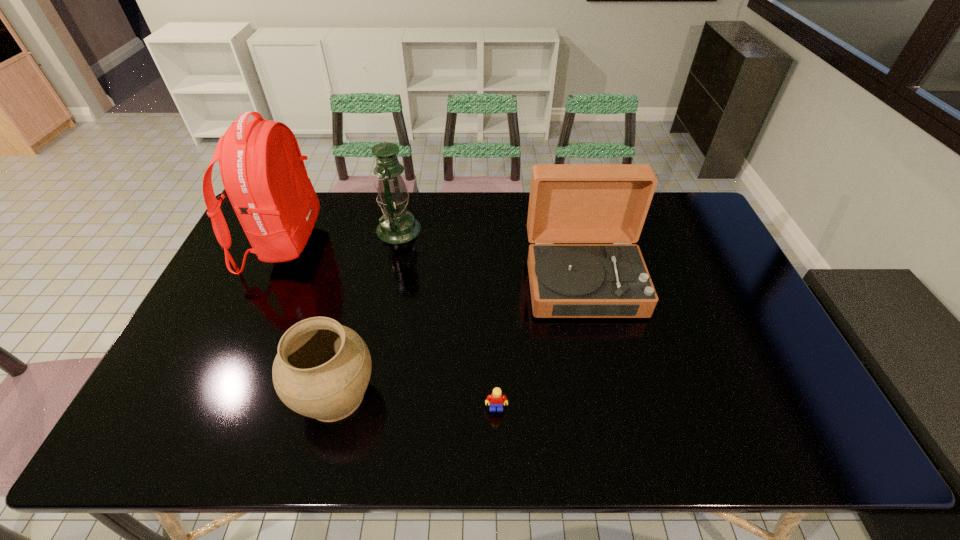
The height and width of the screenshot is (540, 960). What are the coordinates of `free location located 0.140m on the right of the second shortest object` in the screenshot? It's located at (436, 395).

The height and width of the screenshot is (540, 960). I want to click on blank area located 0.060m on the face of the Lego, so click(x=497, y=437).

Find the location of `backpack at the far edge`. backpack at the far edge is located at coordinates (264, 176).

Identify the location of oil lamp at the far edge. (397, 225).

You are a GUI agent. You are given a task and a screenshot of the screen. Output one action in this format:
    pyautogui.click(x=<x>, y=<y>)
    Task: Click on the object present at the near edge
    
    Given the screenshot: What is the action you would take?
    pyautogui.click(x=322, y=369)

Locate an element on the screen. The width and height of the screenshot is (960, 540). object at the left edge is located at coordinates (264, 176).

Where is `object at the far left corner`? This screenshot has height=540, width=960. object at the far left corner is located at coordinates (264, 176).

The image size is (960, 540). In order to click on vacant space at the far edge of the desktop in this screenshot , I will do `click(475, 225)`.

Where is `vacant space at the near edge of the desktop`? This screenshot has width=960, height=540. vacant space at the near edge of the desktop is located at coordinates (273, 429).

At what (x,y) coordinates should I click in order to perform the action: click on vacant space at the left edge. Please return your answer as a coordinate pair (x, y). This screenshot has height=540, width=960. Looking at the image, I should click on (158, 402).